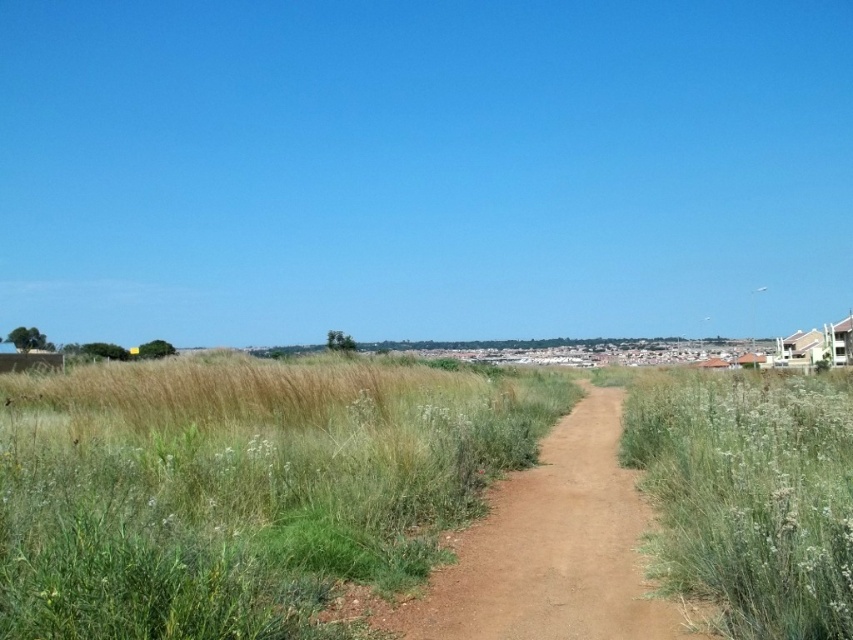
Question: Which point is closer to the camera taking this photo?

Choices:
 (A) (781, 632)
 (B) (556, 376)

Answer: (A)

Question: Which object is closer to the camera taking this photo?

Choices:
 (A) green grassy at center
 (B) green grassy at right

Answer: (A)

Question: Is green grassy at center positioned before green grassy at right?

Choices:
 (A) yes
 (B) no

Answer: (A)

Question: Does green grassy at center have a lesser width compared to green grassy at right?

Choices:
 (A) no
 (B) yes

Answer: (A)

Question: Is green grassy at center positioned in front of green grassy at right?

Choices:
 (A) yes
 (B) no

Answer: (A)